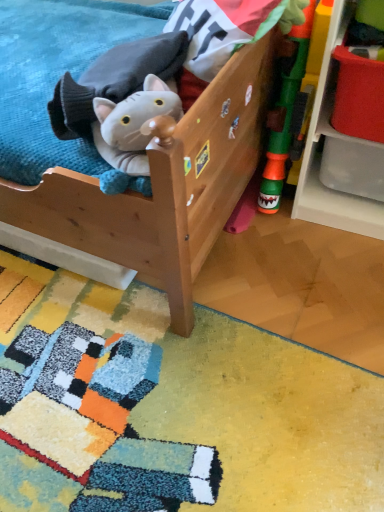
Question: Considering the relative positions of rubberized green toy at right, which is the second toy in left-to-right order, and white plastic shelf at right in the image provided, is rubberized green toy at right, which is the second toy in left-to-right order, to the left of white plastic shelf at right from the viewer's perspective?

Choices:
 (A) no
 (B) yes

Answer: (B)

Question: Considering the relative sizes of rubberized green toy at right, which is the second toy in left-to-right order, and white plastic shelf at right in the image provided, is rubberized green toy at right, which is the second toy in left-to-right order, shorter than white plastic shelf at right?

Choices:
 (A) no
 (B) yes

Answer: (A)

Question: Considering the relative sizes of rubberized green toy at right, the first toy in the right-to-left sequence, and white plastic shelf at right in the image provided, is rubberized green toy at right, the first toy in the right-to-left sequence, taller than white plastic shelf at right?

Choices:
 (A) no
 (B) yes

Answer: (B)

Question: From the image's perspective, would you say rubberized green toy at right, the first toy in the right-to-left sequence, is positioned over white plastic shelf at right?

Choices:
 (A) yes
 (B) no

Answer: (B)

Question: Is rubberized green toy at right, the first toy in the right-to-left sequence, further to camera compared to white plastic shelf at right?

Choices:
 (A) yes
 (B) no

Answer: (A)

Question: From a real-world perspective, is rubberized green toy at right, which is the second toy in left-to-right order, beneath white plastic shelf at right?

Choices:
 (A) no
 (B) yes

Answer: (A)

Question: Is fluffy gray plush cat at upper left, which is the first toy from left to right, to the left of wooden bed at center from the viewer's perspective?

Choices:
 (A) no
 (B) yes

Answer: (A)

Question: Could you tell me if fluffy gray plush cat at upper left, which is the first toy from left to right, is facing wooden bed at center?

Choices:
 (A) yes
 (B) no

Answer: (A)

Question: Does fluffy gray plush cat at upper left, which is the first toy from left to right, come behind wooden bed at center?

Choices:
 (A) yes
 (B) no

Answer: (A)

Question: Is wooden bed at center surrounded by fluffy gray plush cat at upper left, the second toy when ordered from right to left?

Choices:
 (A) no
 (B) yes

Answer: (A)

Question: Considering the relative sizes of fluffy gray plush cat at upper left, which is the first toy from left to right, and wooden bed at center in the image provided, is fluffy gray plush cat at upper left, which is the first toy from left to right, bigger than wooden bed at center?

Choices:
 (A) no
 (B) yes

Answer: (A)

Question: Considering the relative sizes of fluffy gray plush cat at upper left, which is the first toy from left to right, and wooden bed at center in the image provided, is fluffy gray plush cat at upper left, which is the first toy from left to right, smaller than wooden bed at center?

Choices:
 (A) yes
 (B) no

Answer: (A)

Question: From a real-world perspective, is fluffy gray plush cat at upper left, the second toy when ordered from right to left, physically below white plastic shelf at right?

Choices:
 (A) no
 (B) yes

Answer: (A)